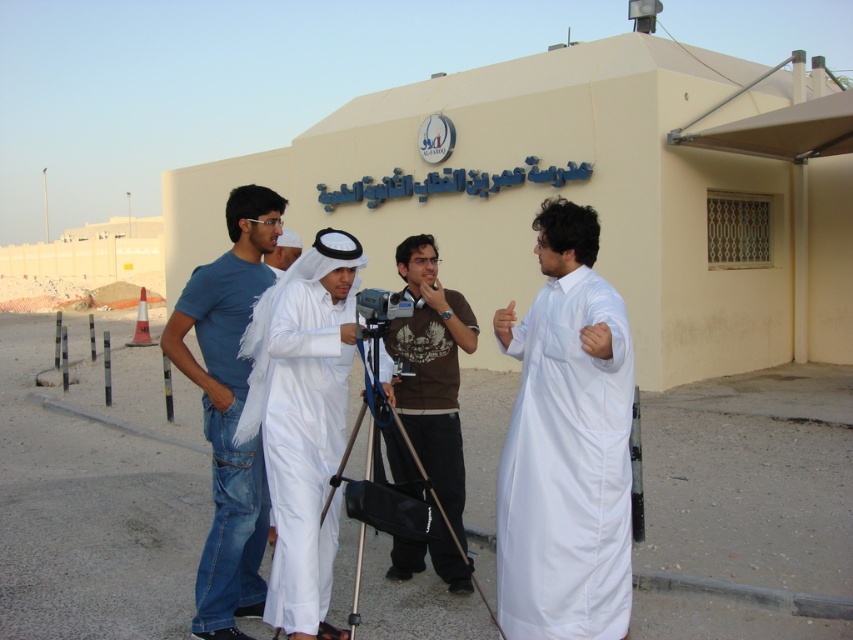
Question: Can you confirm if brown cotton t-shirt at center is positioned below black plastic tripod at center?

Choices:
 (A) yes
 (B) no

Answer: (B)

Question: Among these points, which one is farthest from the camera?

Choices:
 (A) (270, 275)
 (B) (434, 426)

Answer: (B)

Question: Which point is farther from the camera taking this photo?

Choices:
 (A) pos(209,560)
 (B) pos(375,316)
 (C) pos(453,308)

Answer: (C)

Question: In this image, where is white matte robe at center located relative to silver metallic video camera at center?

Choices:
 (A) left
 (B) right

Answer: (A)

Question: Where is blue denim jeans at center located in relation to white matte robe at center in the image?

Choices:
 (A) above
 (B) below

Answer: (A)

Question: Which of these objects is positioned closest to the white matte dress at center?

Choices:
 (A) black plastic tripod at center
 (B) silver metallic video camera at center
 (C) white matte robe at center

Answer: (A)